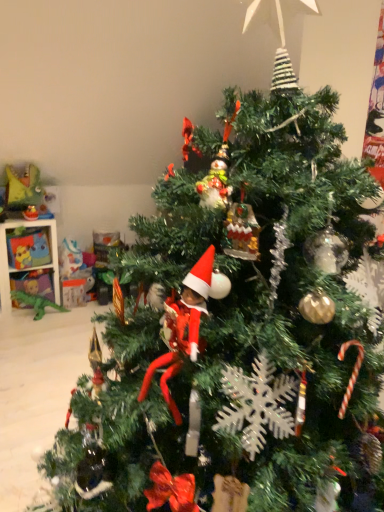
I want to click on matte plastic toy at left, so click(27, 253).

What do you see at coordinates (25, 191) in the screenshot? I see `matte yellow plush toy at left, the third toy when ordered from bottom to top` at bounding box center [25, 191].

Where is `matte yellow toy at upper left, placed as the 2th toy when sorted from top to bottom`? matte yellow toy at upper left, placed as the 2th toy when sorted from top to bottom is located at coordinates (30, 213).

Locate an element on the screen. matte plastic toy at left is located at coordinates pos(27,253).

Is matte yellow toy at upper left, arranged as the 2th toy when ordered from the bottom, next to green plastic dinosaur at left, marked as the 1th toy in a bottom-to-top arrangement?

matte yellow toy at upper left, arranged as the 2th toy when ordered from the bottom, is not next to green plastic dinosaur at left, marked as the 1th toy in a bottom-to-top arrangement, and they're not touching.

Considering the positions of objects matte yellow toy at upper left, placed as the 2th toy when sorted from top to bottom, and green plastic dinosaur at left, marked as the 1th toy in a bottom-to-top arrangement, in the image provided, who is more to the right, matte yellow toy at upper left, placed as the 2th toy when sorted from top to bottom, or green plastic dinosaur at left, marked as the 1th toy in a bottom-to-top arrangement,?

Positioned to the right is green plastic dinosaur at left, marked as the 1th toy in a bottom-to-top arrangement.

Looking at their sizes, would you say matte yellow toy at upper left, arranged as the 2th toy when ordered from the bottom, is wider or thinner than green plastic dinosaur at left, the third toy in the top-to-bottom sequence?

Considering their sizes, matte yellow toy at upper left, arranged as the 2th toy when ordered from the bottom, looks slimmer than green plastic dinosaur at left, the third toy in the top-to-bottom sequence.

Which of these two, matte yellow toy at upper left, placed as the 2th toy when sorted from top to bottom, or green plastic dinosaur at left, the third toy in the top-to-bottom sequence, is bigger?

With larger size is green plastic dinosaur at left, the third toy in the top-to-bottom sequence.

From a real-world perspective, who is located higher, green plastic dinosaur at left, the third toy in the top-to-bottom sequence, or matte plastic toy at left?

matte plastic toy at left, from a real-world perspective.

Is green plastic dinosaur at left, the third toy in the top-to-bottom sequence, in front of or behind matte plastic toy at left in the image?

green plastic dinosaur at left, the third toy in the top-to-bottom sequence, is behind matte plastic toy at left.

Is there a large distance between green plastic dinosaur at left, the third toy in the top-to-bottom sequence, and matte plastic toy at left?

green plastic dinosaur at left, the third toy in the top-to-bottom sequence, is near matte plastic toy at left, not far away.

Which point is more forward, [44,308] or [39,263]?

Positioned in front is point [39,263].

How many degrees apart are the facing directions of matte plastic toy at left and matte yellow plush toy at left, which appears as the 1th toy when viewed from the top?

2.74 degrees separate the facing orientations of matte plastic toy at left and matte yellow plush toy at left, which appears as the 1th toy when viewed from the top.

From the image's perspective, which one is positioned lower, matte plastic toy at left or matte yellow plush toy at left, the third toy when ordered from bottom to top?

matte plastic toy at left.

Is matte plastic toy at left to the right of matte yellow plush toy at left, which appears as the 1th toy when viewed from the top, from the viewer's perspective?

Incorrect, matte plastic toy at left is not on the right side of matte yellow plush toy at left, which appears as the 1th toy when viewed from the top.

Can you see matte plastic toy at left touching matte yellow plush toy at left, which appears as the 1th toy when viewed from the top?

No, matte plastic toy at left is not touching matte yellow plush toy at left, which appears as the 1th toy when viewed from the top.

From a real-world perspective, is matte yellow toy at upper left, placed as the 2th toy when sorted from top to bottom, positioned above or below matte plastic toy at left?

matte yellow toy at upper left, placed as the 2th toy when sorted from top to bottom, is above matte plastic toy at left.

Is matte yellow toy at upper left, placed as the 2th toy when sorted from top to bottom, facing towards matte plastic toy at left?

No, matte yellow toy at upper left, placed as the 2th toy when sorted from top to bottom, is not aimed at matte plastic toy at left.

Who is shorter, matte yellow toy at upper left, arranged as the 2th toy when ordered from the bottom, or matte plastic toy at left?

Standing shorter between the two is matte yellow toy at upper left, arranged as the 2th toy when ordered from the bottom.

Is matte yellow toy at upper left, arranged as the 2th toy when ordered from the bottom, touching matte plastic toy at left?

No, matte yellow toy at upper left, arranged as the 2th toy when ordered from the bottom, is not making contact with matte plastic toy at left.

Visually, is matte yellow plush toy at left, which appears as the 1th toy when viewed from the top, positioned to the left or to the right of matte yellow toy at upper left, arranged as the 2th toy when ordered from the bottom?

Based on their positions, matte yellow plush toy at left, which appears as the 1th toy when viewed from the top, is located to the left of matte yellow toy at upper left, arranged as the 2th toy when ordered from the bottom.

Is matte yellow plush toy at left, which appears as the 1th toy when viewed from the top, shorter than matte yellow toy at upper left, arranged as the 2th toy when ordered from the bottom?

Incorrect, the height of matte yellow plush toy at left, which appears as the 1th toy when viewed from the top, does not fall short of that of matte yellow toy at upper left, arranged as the 2th toy when ordered from the bottom.

Does matte yellow plush toy at left, which appears as the 1th toy when viewed from the top, turn towards matte yellow toy at upper left, placed as the 2th toy when sorted from top to bottom?

Yes, matte yellow plush toy at left, which appears as the 1th toy when viewed from the top, is aimed at matte yellow toy at upper left, placed as the 2th toy when sorted from top to bottom.

Which object is wider, matte yellow plush toy at left, which appears as the 1th toy when viewed from the top, or matte yellow toy at upper left, arranged as the 2th toy when ordered from the bottom?

With larger width is matte yellow plush toy at left, which appears as the 1th toy when viewed from the top.

Is point (24, 257) closer to viewer compared to point (27, 218)?

No, it is not.

Is matte plastic toy at left bigger or smaller than matte yellow toy at upper left, arranged as the 2th toy when ordered from the bottom?

Clearly, matte plastic toy at left is larger in size than matte yellow toy at upper left, arranged as the 2th toy when ordered from the bottom.

What's the angular difference between matte plastic toy at left and matte yellow toy at upper left, placed as the 2th toy when sorted from top to bottom,'s facing directions?

13.7 degrees.

Is matte yellow toy at upper left, arranged as the 2th toy when ordered from the bottom, inside matte plastic toy at left?

Definitely not — matte yellow toy at upper left, arranged as the 2th toy when ordered from the bottom, is not inside matte plastic toy at left.

This screenshot has width=384, height=512. In order to click on toy that is the 2nd one when counting leftward from the green plastic dinosaur at left, the third toy in the top-to-bottom sequence in this screenshot , I will do `click(25, 191)`.

In terms of size, does green plastic dinosaur at left, marked as the 1th toy in a bottom-to-top arrangement, appear bigger or smaller than matte yellow plush toy at left, the third toy when ordered from bottom to top?

In the image, green plastic dinosaur at left, marked as the 1th toy in a bottom-to-top arrangement, appears to be smaller than matte yellow plush toy at left, the third toy when ordered from bottom to top.

Is the depth of green plastic dinosaur at left, the third toy in the top-to-bottom sequence, greater than that of matte yellow plush toy at left, which appears as the 1th toy when viewed from the top?

Yes, the depth of green plastic dinosaur at left, the third toy in the top-to-bottom sequence, is greater than that of matte yellow plush toy at left, which appears as the 1th toy when viewed from the top.

From the image's perspective, which is above, green plastic dinosaur at left, the third toy in the top-to-bottom sequence, or matte yellow plush toy at left, which appears as the 1th toy when viewed from the top?

matte yellow plush toy at left, which appears as the 1th toy when viewed from the top, from the image's perspective.

From the image's perspective, count 1st toys upward from the green plastic dinosaur at left, marked as the 1th toy in a bottom-to-top arrangement, and point to it. Please provide its 2D coordinates.

[(30, 213)]

Locate an element on the screen. This screenshot has height=512, width=384. shelf lying on the left of green plastic dinosaur at left, marked as the 1th toy in a bottom-to-top arrangement is located at coordinates (27, 253).

When comparing their distances from matte yellow toy at upper left, arranged as the 2th toy when ordered from the bottom, does matte yellow plush toy at left, which appears as the 1th toy when viewed from the top, or matte plastic toy at left seem closer?

The object closer to matte yellow toy at upper left, arranged as the 2th toy when ordered from the bottom, is matte yellow plush toy at left, which appears as the 1th toy when viewed from the top.

Looking at the image, which one is located closer to matte yellow toy at upper left, placed as the 2th toy when sorted from top to bottom, green plastic dinosaur at left, marked as the 1th toy in a bottom-to-top arrangement, or matte yellow plush toy at left, the third toy when ordered from bottom to top?

Among the two, matte yellow plush toy at left, the third toy when ordered from bottom to top, is located nearer to matte yellow toy at upper left, placed as the 2th toy when sorted from top to bottom.

Considering their positions, is matte yellow plush toy at left, the third toy when ordered from bottom to top, positioned further to matte plastic toy at left than green plastic dinosaur at left, marked as the 1th toy in a bottom-to-top arrangement?

matte yellow plush toy at left, the third toy when ordered from bottom to top, is further to matte plastic toy at left.

Looking at the image, which one is located further to green plastic dinosaur at left, marked as the 1th toy in a bottom-to-top arrangement, matte yellow plush toy at left, the third toy when ordered from bottom to top, or matte plastic toy at left?

matte yellow plush toy at left, the third toy when ordered from bottom to top, lies further to green plastic dinosaur at left, marked as the 1th toy in a bottom-to-top arrangement, than the other object.

Considering their positions, is matte yellow toy at upper left, arranged as the 2th toy when ordered from the bottom, positioned further to green plastic dinosaur at left, marked as the 1th toy in a bottom-to-top arrangement, than matte yellow plush toy at left, the third toy when ordered from bottom to top?

matte yellow plush toy at left, the third toy when ordered from bottom to top.

Looking at this image, estimate the real-world distances between objects in this image. Which object is further from matte yellow plush toy at left, which appears as the 1th toy when viewed from the top, matte plastic toy at left or green plastic dinosaur at left, the third toy in the top-to-bottom sequence?

green plastic dinosaur at left, the third toy in the top-to-bottom sequence, lies further to matte yellow plush toy at left, which appears as the 1th toy when viewed from the top, than the other object.

When comparing their distances from matte plastic toy at left, does matte yellow toy at upper left, arranged as the 2th toy when ordered from the bottom, or green plastic dinosaur at left, the third toy in the top-to-bottom sequence, seem closer?

The object closer to matte plastic toy at left is green plastic dinosaur at left, the third toy in the top-to-bottom sequence.

From the image, which object appears to be farther from matte yellow plush toy at left, the third toy when ordered from bottom to top, matte yellow toy at upper left, arranged as the 2th toy when ordered from the bottom, or matte plastic toy at left?

The object further to matte yellow plush toy at left, the third toy when ordered from bottom to top, is matte plastic toy at left.

Where is `toy between matte yellow plush toy at left, the third toy when ordered from bottom to top, and matte plastic toy at left from top to bottom`? The height and width of the screenshot is (512, 384). toy between matte yellow plush toy at left, the third toy when ordered from bottom to top, and matte plastic toy at left from top to bottom is located at coordinates (30, 213).

Find the location of a particular element. The height and width of the screenshot is (512, 384). toy between matte yellow plush toy at left, which appears as the 1th toy when viewed from the top, and green plastic dinosaur at left, marked as the 1th toy in a bottom-to-top arrangement, vertically is located at coordinates (30, 213).

Find the location of a particular element. shelf between matte yellow toy at upper left, placed as the 2th toy when sorted from top to bottom, and green plastic dinosaur at left, the third toy in the top-to-bottom sequence, vertically is located at coordinates (27, 253).

Find the location of a particular element. shelf between matte yellow plush toy at left, which appears as the 1th toy when viewed from the top, and green plastic dinosaur at left, the third toy in the top-to-bottom sequence, vertically is located at coordinates (27, 253).